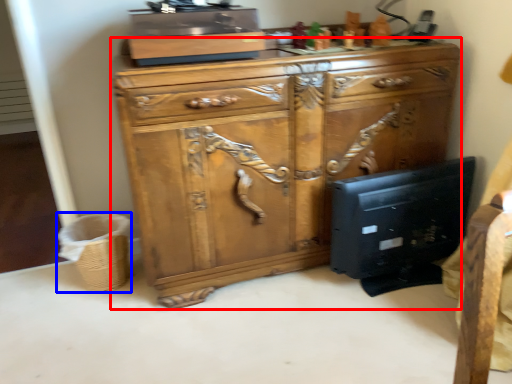
Question: Which object appears farthest to the camera in this image, chest of drawers (highlighted by a red box) or basket (highlighted by a blue box)?

Choices:
 (A) chest of drawers
 (B) basket

Answer: (B)